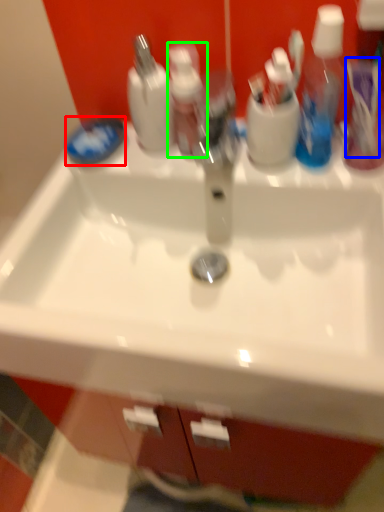
Question: Which is farther away from soap (highlighted by a red box)? toothbrush (highlighted by a blue box) or toiletry (highlighted by a green box)?

Choices:
 (A) toothbrush
 (B) toiletry

Answer: (A)